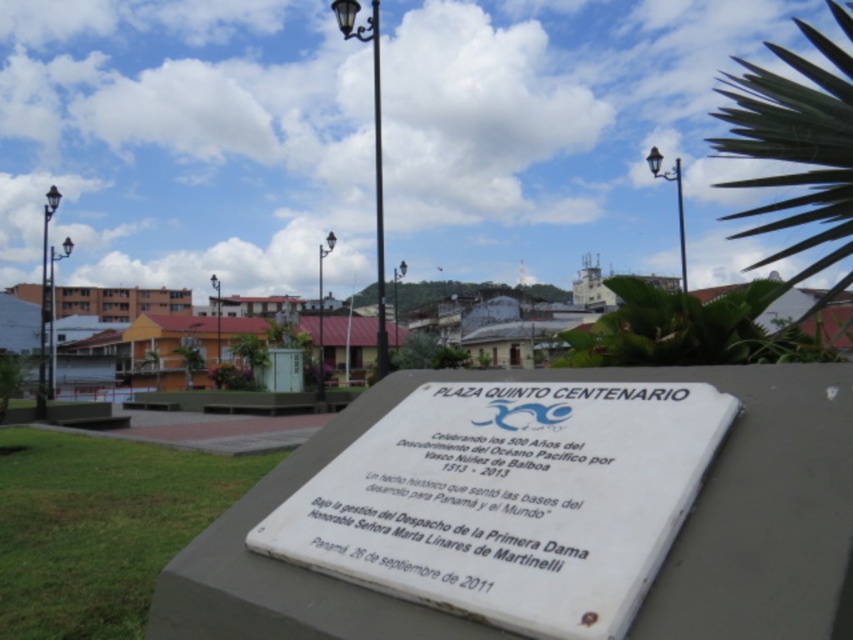
Question: Which is nearer to the black wrought iron lamp post at upper center?

Choices:
 (A) white stone plaque at center
 (B) metallic streetlight at left
 (C) white marble plaque at center
 (D) metallic lamp post at center

Answer: (C)

Question: Can you confirm if white marble plaque at center is positioned above metallic pole at upper center?

Choices:
 (A) yes
 (B) no

Answer: (B)

Question: Does black metal lamp post at upper center appear on the right side of metallic lamp post at upper center?

Choices:
 (A) yes
 (B) no

Answer: (A)

Question: Which is farther from the metallic lamp post at center?

Choices:
 (A) metallic lamp post at upper center
 (B) black metal lamp post at upper center
 (C) metallic streetlight at left
 (D) white stone plaque at center

Answer: (D)

Question: Which of these objects is positioned farthest from the metallic streetlight at left?

Choices:
 (A) metallic lamp post at center
 (B) white stone plaque at center

Answer: (A)

Question: Does black wrought iron lamp post at upper center have a smaller size compared to black metal lamp post at upper center?

Choices:
 (A) yes
 (B) no

Answer: (A)